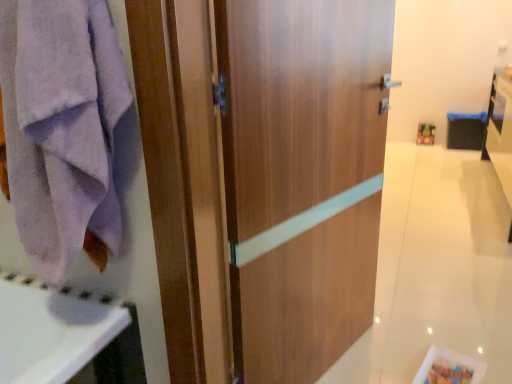
Question: From a real-world perspective, is white glossy vanity at right on lavender cotton towel at left?

Choices:
 (A) yes
 (B) no

Answer: (B)

Question: Does white glossy vanity at right turn towards lavender cotton towel at left?

Choices:
 (A) yes
 (B) no

Answer: (B)

Question: Can you confirm if white glossy vanity at right is bigger than lavender cotton towel at left?

Choices:
 (A) yes
 (B) no

Answer: (A)

Question: Is white glossy vanity at right to the left of lavender cotton towel at left from the viewer's perspective?

Choices:
 (A) no
 (B) yes

Answer: (A)

Question: Is white glossy vanity at right taller than lavender cotton towel at left?

Choices:
 (A) no
 (B) yes

Answer: (B)

Question: Is lavender cotton towel at left wider or thinner than white glossy vanity at right?

Choices:
 (A) thin
 (B) wide

Answer: (A)

Question: In the image, is lavender cotton towel at left on the left side or the right side of white glossy vanity at right?

Choices:
 (A) right
 (B) left

Answer: (B)

Question: Is point [x=34, y=44] closer or farther from the camera than point [x=483, y=140]?

Choices:
 (A) closer
 (B) farther

Answer: (A)

Question: Relative to white glossy vanity at right, is lavender cotton towel at left in front or behind?

Choices:
 (A) behind
 (B) front

Answer: (B)

Question: Considering their positions, is wooden door at center located in front of or behind white glossy vanity at right?

Choices:
 (A) front
 (B) behind

Answer: (A)

Question: Is wooden door at center wider or thinner than white glossy vanity at right?

Choices:
 (A) wide
 (B) thin

Answer: (B)

Question: Is wooden door at center situated inside white glossy vanity at right or outside?

Choices:
 (A) inside
 (B) outside

Answer: (B)

Question: From their relative heights in the image, would you say wooden door at center is taller or shorter than white glossy vanity at right?

Choices:
 (A) tall
 (B) short

Answer: (A)

Question: Is wooden door at center spatially inside lavender cotton towel at left, or outside of it?

Choices:
 (A) outside
 (B) inside

Answer: (A)

Question: Would you say wooden door at center is to the left or to the right of lavender cotton towel at left in the picture?

Choices:
 (A) right
 (B) left

Answer: (A)